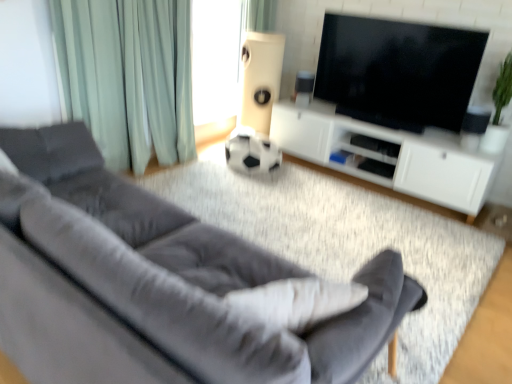
Question: Is the depth of white matte speaker at center, marked as the second speaker in a right-to-left arrangement, less than that of black glossy tv at upper center?

Choices:
 (A) yes
 (B) no

Answer: (B)

Question: From a real-world perspective, is white matte speaker at center, marked as the second speaker in a right-to-left arrangement, positioned under black glossy tv at upper center based on gravity?

Choices:
 (A) no
 (B) yes

Answer: (B)

Question: From a real-world perspective, is white matte speaker at center, marked as the second speaker in a right-to-left arrangement, on black glossy tv at upper center?

Choices:
 (A) yes
 (B) no

Answer: (B)

Question: Considering the relative positions of white matte speaker at center, which is counted as the first speaker, starting from the left, and black glossy tv at upper center in the image provided, is white matte speaker at center, which is counted as the first speaker, starting from the left, behind black glossy tv at upper center?

Choices:
 (A) yes
 (B) no

Answer: (A)

Question: Is white matte speaker at center, which is counted as the first speaker, starting from the left, at the left side of black glossy tv at upper center?

Choices:
 (A) no
 (B) yes

Answer: (B)

Question: Is velvet gray couch at lower left in front of or behind white matte speaker at center, marked as the second speaker in a right-to-left arrangement, in the image?

Choices:
 (A) front
 (B) behind

Answer: (A)

Question: Is velvet gray couch at lower left taller or shorter than white matte speaker at center, which is counted as the first speaker, starting from the left?

Choices:
 (A) tall
 (B) short

Answer: (B)

Question: Does point (123, 266) appear closer or farther from the camera than point (244, 62)?

Choices:
 (A) closer
 (B) farther

Answer: (A)

Question: From the image's perspective, relative to white matte speaker at center, marked as the second speaker in a right-to-left arrangement, is velvet gray couch at lower left above or below?

Choices:
 (A) below
 (B) above

Answer: (A)

Question: From a real-world perspective, is green fabric curtain at upper center, the first curtain from the back, positioned above or below white matte cabinet at center?

Choices:
 (A) below
 (B) above

Answer: (B)

Question: In the image, is green fabric curtain at upper center, the 1th curtain when ordered from top to bottom, on the left side or the right side of white matte cabinet at center?

Choices:
 (A) left
 (B) right

Answer: (A)

Question: In terms of width, does green fabric curtain at upper center, the first curtain from the back, look wider or thinner when compared to white matte cabinet at center?

Choices:
 (A) wide
 (B) thin

Answer: (B)

Question: Considering the positions of point (250, 19) and point (486, 157), is point (250, 19) closer or farther from the camera than point (486, 157)?

Choices:
 (A) farther
 (B) closer

Answer: (A)

Question: Is point (214, 340) closer or farther from the camera than point (475, 198)?

Choices:
 (A) farther
 (B) closer

Answer: (B)

Question: Would you say velvet gray couch at lower left is inside or outside white matte cabinet at center?

Choices:
 (A) inside
 (B) outside

Answer: (B)